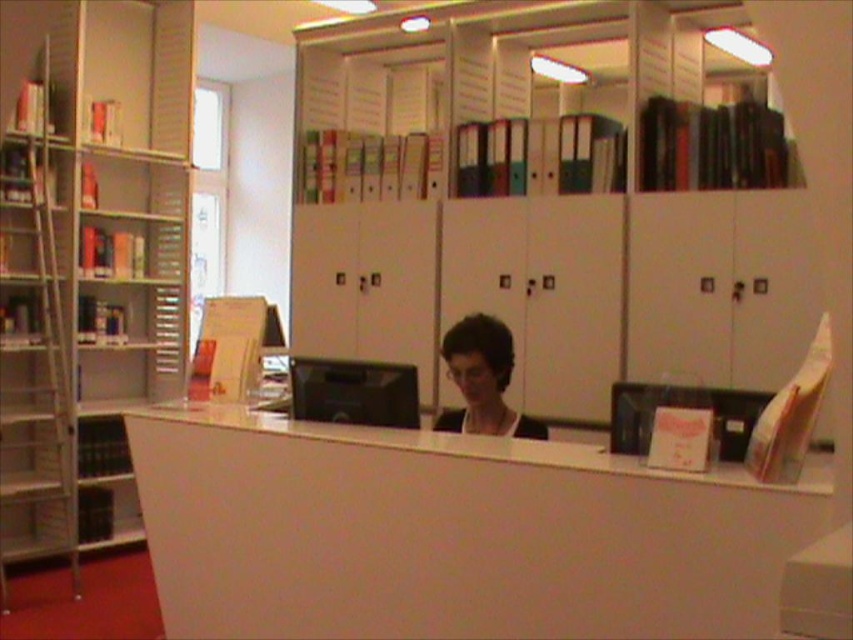
Measure the distance between white matte desk at center and matte black hair at center.

29.28 inches

Does white matte desk at center have a lesser height compared to matte black hair at center?

In fact, white matte desk at center may be taller than matte black hair at center.

Is point (614, 506) more distant than point (508, 413)?

No.

Where is `white matte desk at center`? This screenshot has height=640, width=853. white matte desk at center is located at coordinates (451, 532).

Which of these two, metallic silver bookshelf at left or matte black hair at center, stands taller?

With more height is metallic silver bookshelf at left.

Where is `metallic silver bookshelf at left`? The image size is (853, 640). metallic silver bookshelf at left is located at coordinates (90, 260).

Which is in front, point (126, 100) or point (473, 388)?

Point (473, 388) is in front.

Identify the location of metallic silver bookshelf at left. Image resolution: width=853 pixels, height=640 pixels. (90, 260).

Can you confirm if white matte desk at center is thinner than metallic silver bookshelf at left?

In fact, white matte desk at center might be wider than metallic silver bookshelf at left.

Who is more distant from viewer, (799, 488) or (97, 509)?

Positioned behind is point (97, 509).

At what (x,y) coordinates should I click in order to perform the action: click on white matte desk at center. Please return your answer as a coordinate pair (x, y). The width and height of the screenshot is (853, 640). Looking at the image, I should click on (451, 532).

This screenshot has height=640, width=853. What are the coordinates of `white matte desk at center` in the screenshot? It's located at (451, 532).